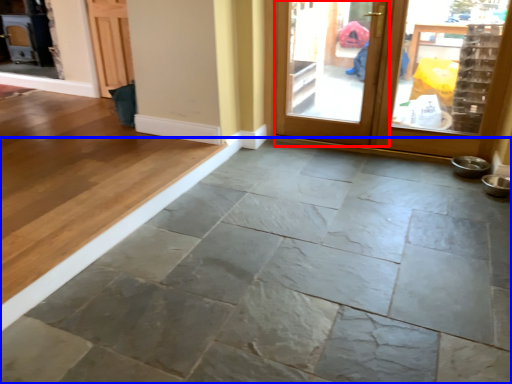
Question: Which object appears closest to the camera in this image, screen door (highlighted by a red box) or concrete (highlighted by a blue box)?

Choices:
 (A) screen door
 (B) concrete

Answer: (B)